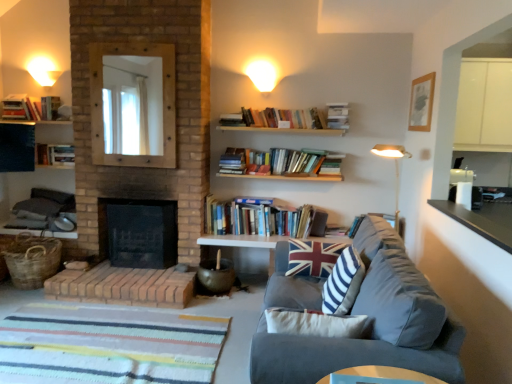
You are a GUI agent. You are given a task and a screenshot of the screen. Output one action in this format:
    pyautogui.click(x=<x>, y=<y>)
    Task: Click on the blank space situated above striped wool rug at lower left (from a real-world perspective)
    Image resolution: width=512 pixels, height=384 pixels.
    Given the screenshot: What is the action you would take?
    pyautogui.click(x=113, y=343)